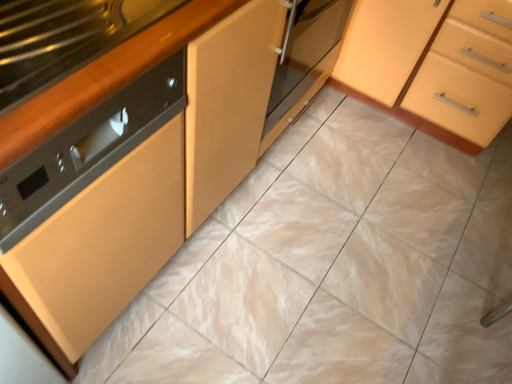
Question: Which is correct: black glossy countertop at left is inside matte orange cabinet at center-right, or outside of it?

Choices:
 (A) inside
 (B) outside

Answer: (B)

Question: Considering the positions of black glossy countertop at left and matte orange cabinet at center-right in the image, is black glossy countertop at left wider or thinner than matte orange cabinet at center-right?

Choices:
 (A) thin
 (B) wide

Answer: (A)

Question: Considering the positions of point (181, 9) and point (356, 38), is point (181, 9) closer or farther from the camera than point (356, 38)?

Choices:
 (A) closer
 (B) farther

Answer: (A)

Question: Visually, is matte orange cabinet at center-right positioned to the left or to the right of black glossy countertop at left?

Choices:
 (A) left
 (B) right

Answer: (B)

Question: From the image's perspective, is matte orange cabinet at center-right positioned above or below black glossy countertop at left?

Choices:
 (A) below
 (B) above

Answer: (B)

Question: In terms of width, does matte orange cabinet at center-right look wider or thinner when compared to black glossy countertop at left?

Choices:
 (A) wide
 (B) thin

Answer: (A)

Question: Looking at the image, does matte orange cabinet at center-right seem bigger or smaller compared to black glossy countertop at left?

Choices:
 (A) big
 (B) small

Answer: (A)